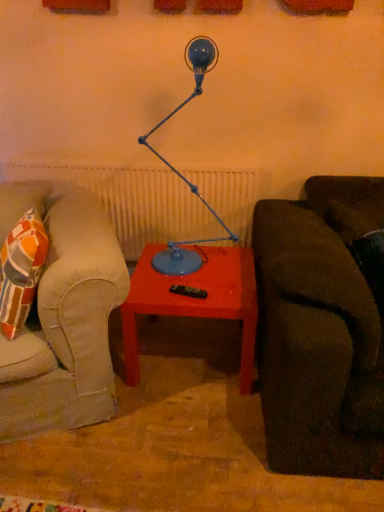
Identify the location of unoccupied area in front of matte red table at center. The width and height of the screenshot is (384, 512). (172, 443).